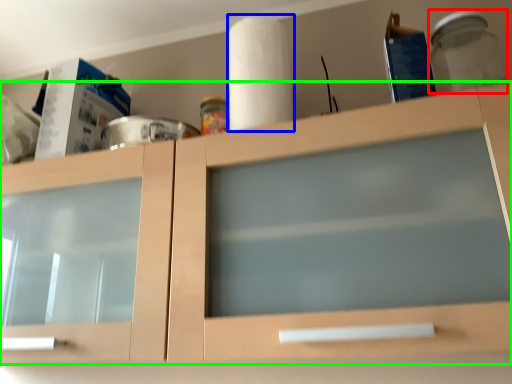
Question: Which object is the closest to the glass jar (highlighted by a red box)? Choose among these: paper towel (highlighted by a blue box) or cabinetry (highlighted by a green box).

Choices:
 (A) paper towel
 (B) cabinetry

Answer: (A)